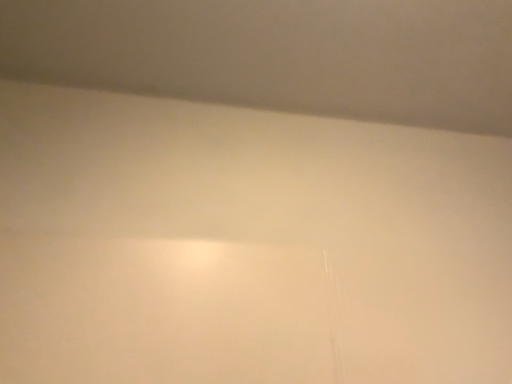
In order to face matte white wall at upper left, should I rotate leftwards or rightwards?

Rotate your view right by about 8.425°.

The image size is (512, 384). What are the coordinates of `matte white wall at upper left` in the screenshot? It's located at coord(279,55).

The width and height of the screenshot is (512, 384). What do you see at coordinates (279, 55) in the screenshot?
I see `matte white wall at upper left` at bounding box center [279, 55].

Identify the location of matte white wall at upper left. (279, 55).